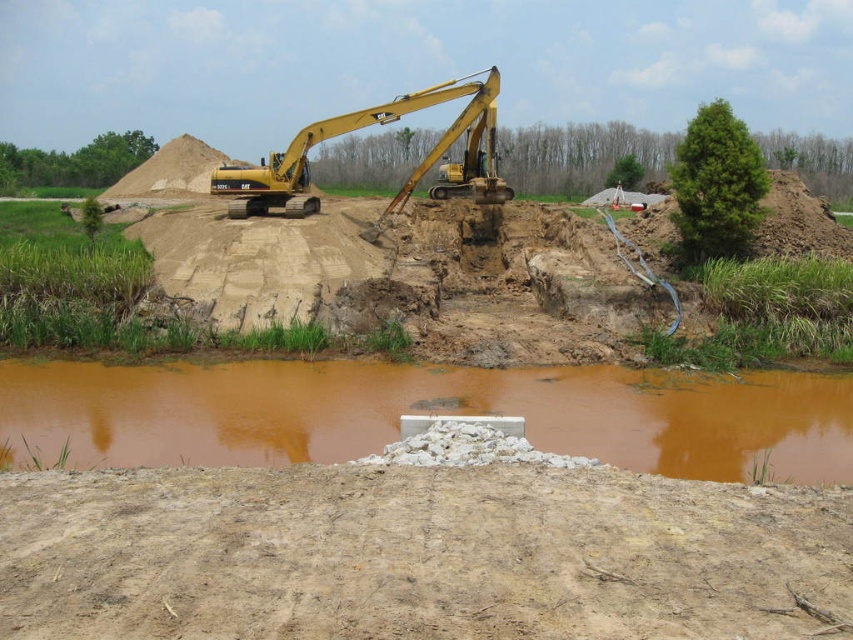
Question: Can you confirm if dull brown dirt at lower center is wider than brown sediment water at center?

Choices:
 (A) yes
 (B) no

Answer: (B)

Question: Is dull brown dirt at lower center below brown sediment water at center?

Choices:
 (A) yes
 (B) no

Answer: (A)

Question: Considering the real-world distances, which object is closest to the brown sediment water at center?

Choices:
 (A) yellow metallic excavator at center
 (B) dull brown dirt at lower center

Answer: (B)

Question: Which object appears closest to the camera in this image?

Choices:
 (A) yellow metallic excavator at center
 (B) brown sediment water at center

Answer: (B)

Question: Is brown sediment water at center positioned behind yellow metallic excavator at center?

Choices:
 (A) no
 (B) yes

Answer: (A)

Question: Estimate the real-world distances between objects in this image. Which object is farther from the dull brown dirt at lower center?

Choices:
 (A) brown sediment water at center
 (B) yellow metallic excavator at center

Answer: (B)